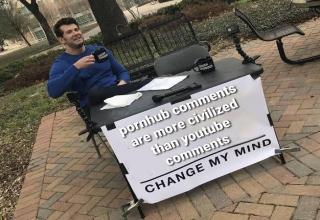
Locate an element on the screen. empty seats is located at coordinates (175, 61), (141, 67), (176, 42), (275, 30).